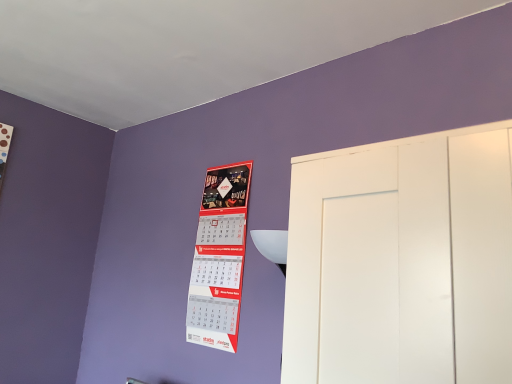
Image resolution: width=512 pixels, height=384 pixels. In order to click on red glossy calendar at center in this screenshot , I will do `click(219, 258)`.

The height and width of the screenshot is (384, 512). Describe the element at coordinates (219, 258) in the screenshot. I see `red glossy calendar at center` at that location.

The width and height of the screenshot is (512, 384). What are the coordinates of `red glossy calendar at center` in the screenshot? It's located at (219, 258).